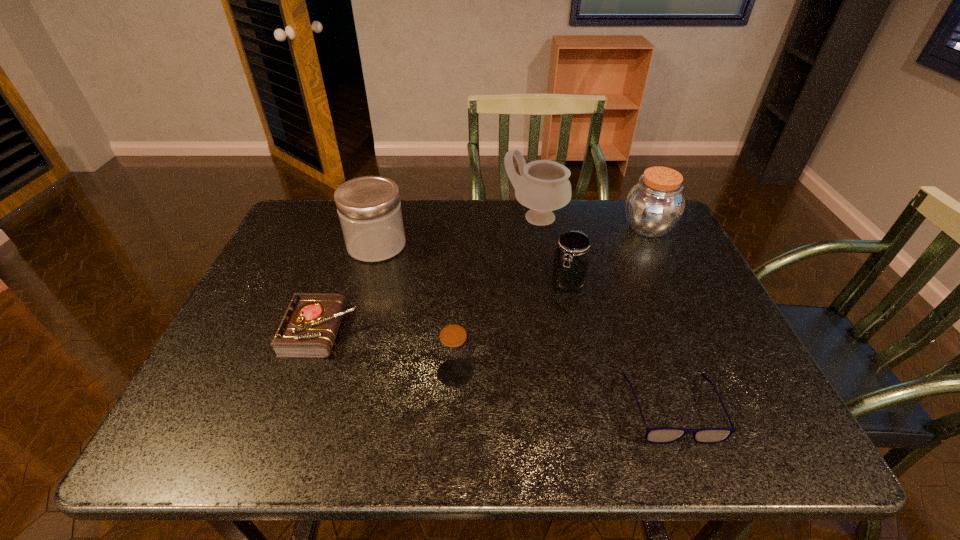
The image size is (960, 540). Find the location of `object at the far right corner`. object at the far right corner is located at coordinates (655, 205).

Where is `object that is at the near right corner`? The image size is (960, 540). object that is at the near right corner is located at coordinates (659, 435).

You are a GUI agent. You are given a task and a screenshot of the screen. Output one action in this format:
    pyautogui.click(x=<x>, y=<y>)
    Task: Click on the vacant position at the far edge of the desktop
    The height and width of the screenshot is (540, 960).
    Given the screenshot: What is the action you would take?
    pyautogui.click(x=516, y=232)

This screenshot has width=960, height=540. In order to click on free space at the near edge of the desktop in this screenshot , I will do `click(457, 422)`.

Locate an element on the screen. The height and width of the screenshot is (540, 960). vacant space at the left edge is located at coordinates (309, 289).

You are a GUI agent. You are given a task and a screenshot of the screen. Output one action in this format:
    pyautogui.click(x=<x>, y=<y>)
    Task: Click on the vacant region at the right edge
    The width and height of the screenshot is (960, 540).
    Given the screenshot: What is the action you would take?
    pyautogui.click(x=686, y=367)

Find the location of `vacant space at the far left corner of the desktop`. vacant space at the far left corner of the desktop is located at coordinates (331, 220).

Image resolution: width=960 pixels, height=540 pixels. In order to click on blank space at the near right corner of the desktop in this screenshot , I will do (x=765, y=426).

Where is `free space between the leftmost jar and the rightmost jar`? The height and width of the screenshot is (540, 960). free space between the leftmost jar and the rightmost jar is located at coordinates (513, 236).

The width and height of the screenshot is (960, 540). I want to click on free space between the pottery and the diary, so coord(429,274).